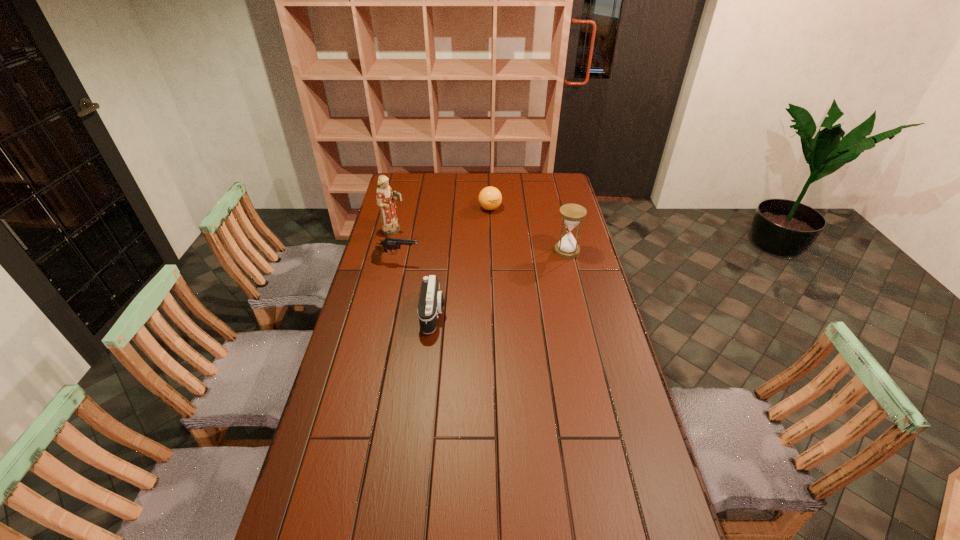
Identify the location of the third object from right to left. (431, 302).

At what (x,y) coordinates should I click in order to perform the action: click on the nearest object. Please return your answer as a coordinate pair (x, y). The width and height of the screenshot is (960, 540). Looking at the image, I should click on (431, 302).

You are a GUI agent. You are given a task and a screenshot of the screen. Output one action in this format:
    pyautogui.click(x=<x>, y=<y>)
    Task: Click on the fourth shortest object
    This screenshot has height=540, width=960.
    Given the screenshot: What is the action you would take?
    pyautogui.click(x=572, y=214)

Find the location of a particular element. This screenshot has height=540, width=960. the third farthest object is located at coordinates (572, 214).

This screenshot has height=540, width=960. Find the location of `gun`. gun is located at coordinates (389, 243).

Locate an element on the screen. The image size is (960, 540). the tallest object is located at coordinates (385, 199).

The width and height of the screenshot is (960, 540). What are the coordinates of `figurine` in the screenshot? It's located at (385, 199).

In order to click on the second object from right to left in this screenshot , I will do `click(490, 198)`.

Where is `the farthest object`? The width and height of the screenshot is (960, 540). the farthest object is located at coordinates (490, 198).

At what (x,y) coordinates should I click in order to perform the action: click on free space located on the front lens of the third object from right to left. Please return your answer as a coordinate pair (x, y). This screenshot has height=540, width=960. Looking at the image, I should click on (532, 314).